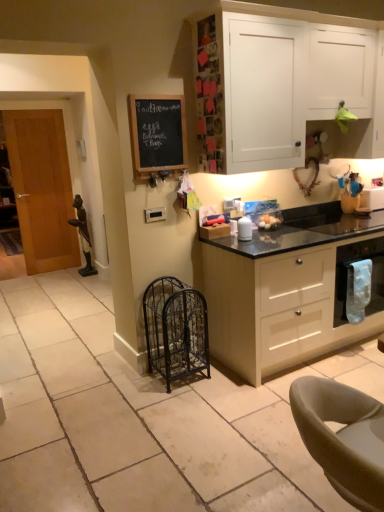
Identify the location of free space to the left of black wrought iron cage at lower center. The height and width of the screenshot is (512, 384). (125, 387).